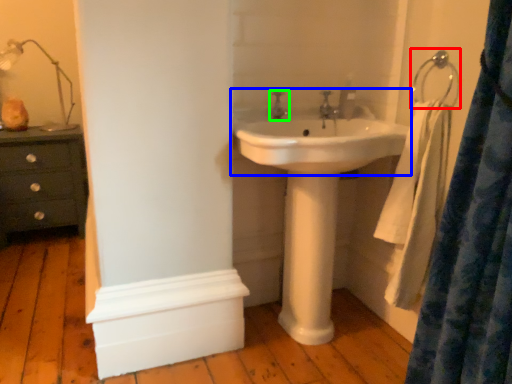
Question: Which object is positioned farthest from hang (highlighted by a red box)? Select from sink (highlighted by a blue box) and tap (highlighted by a green box).

Choices:
 (A) sink
 (B) tap

Answer: (B)